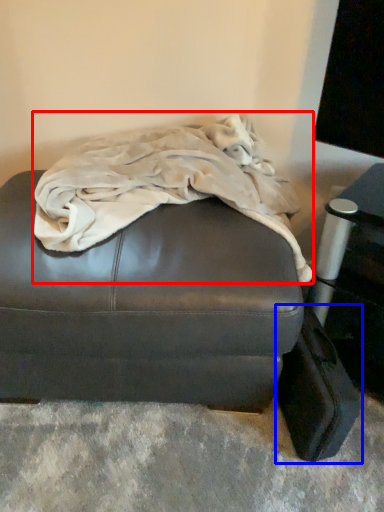
Question: Which object appears closest to the camera in this image, blanket (highlighted by a red box) or luggage (highlighted by a blue box)?

Choices:
 (A) blanket
 (B) luggage

Answer: (A)